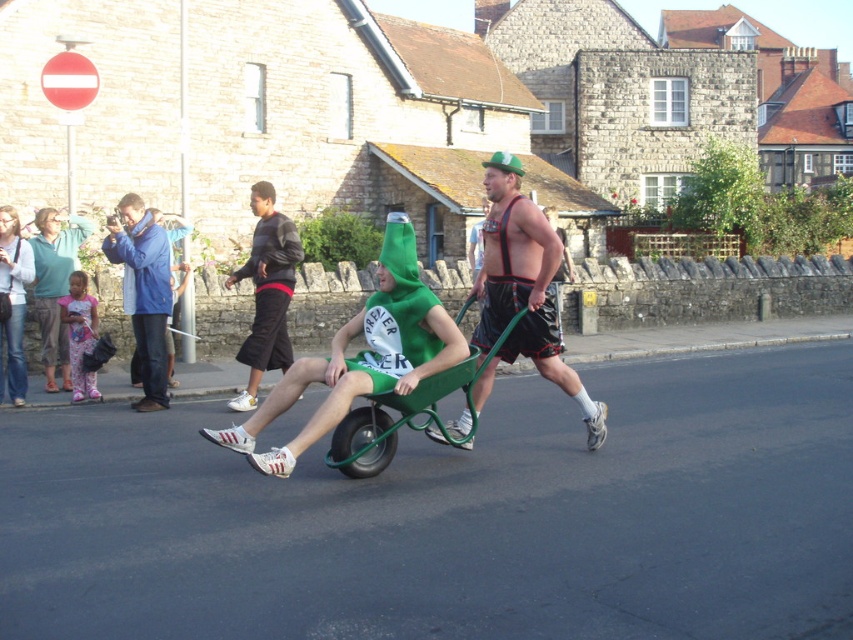
Which of these two, shiny metallic shorts at center or striped sweater at center, stands shorter?

shiny metallic shorts at center is shorter.

Which is more to the right, shiny metallic shorts at center or striped sweater at center?

Positioned to the right is shiny metallic shorts at center.

You are a GUI agent. You are given a task and a screenshot of the screen. Output one action in this format:
    pyautogui.click(x=<x>, y=<y>)
    Task: Click on the shiny metallic shorts at center
    The image size is (853, 640).
    Given the screenshot: What is the action you would take?
    pyautogui.click(x=523, y=291)

Is green plastic wheelbarrow at center smaller than striped sweater at center?

Yes, green plastic wheelbarrow at center is smaller than striped sweater at center.

Identify the location of green plastic wheelbarrow at center. The image size is (853, 640). (407, 412).

At what (x,y) coordinates should I click in order to perform the action: click on green plastic wheelbarrow at center. Please return your answer as a coordinate pair (x, y). The height and width of the screenshot is (640, 853). Looking at the image, I should click on (407, 412).

Which of these two, shiny metallic shorts at center or blue fabric jacket at left, stands taller?

shiny metallic shorts at center

Who is shorter, shiny metallic shorts at center or blue fabric jacket at left?

blue fabric jacket at left is shorter.

Describe the element at coordinates (523, 291) in the screenshot. I see `shiny metallic shorts at center` at that location.

The width and height of the screenshot is (853, 640). In order to click on shiny metallic shorts at center in this screenshot , I will do `click(523, 291)`.